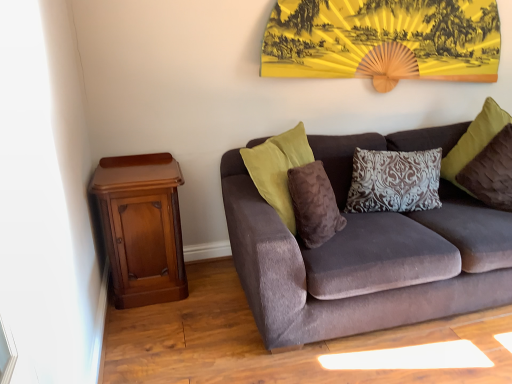
What is the approximate height of mahogany wood nightstand at left?

mahogany wood nightstand at left is 29.92 inches tall.

This screenshot has width=512, height=384. In order to click on yellow paper fan at upper center in this screenshot , I will do `click(383, 40)`.

Describe the element at coordinates (474, 140) in the screenshot. I see `velvet brown pillow at upper right, marked as the 3th pillow in a left-to-right arrangement` at that location.

Where is `mahogany wood nightstand at left`? This screenshot has width=512, height=384. mahogany wood nightstand at left is located at coordinates (142, 227).

Which is closer, [160,179] or [437,186]?

Point [160,179] is positioned closer to the camera compared to point [437,186].

Where is `the 1st pillow directly above the mahogany wood nightstand at left (from a real-world perspective)`? The height and width of the screenshot is (384, 512). the 1st pillow directly above the mahogany wood nightstand at left (from a real-world perspective) is located at coordinates (394, 181).

From a real-world perspective, who is located lower, mahogany wood nightstand at left or brown damask pillow at center, placed as the 2th pillow when sorted from left to right?

mahogany wood nightstand at left.

From the picture: Who is shorter, mahogany wood nightstand at left or brown damask pillow at center, placed as the 2th pillow when sorted from left to right?

With less height is brown damask pillow at center, placed as the 2th pillow when sorted from left to right.

Would you say velvet brown couch at center is part of mahogany wood nightstand at left's contents?

No.

Considering the sizes of mahogany wood nightstand at left and velvet brown couch at center in the image, is mahogany wood nightstand at left bigger or smaller than velvet brown couch at center?

In the image, mahogany wood nightstand at left appears to be smaller than velvet brown couch at center.

This screenshot has width=512, height=384. In order to click on studio couch above the mahogany wood nightstand at left (from the image's perspective) in this screenshot , I will do `click(365, 264)`.

From a real-world perspective, is mahogany wood nightstand at left located higher than velvet brown couch at center?

Incorrect, from a real-world perspective, mahogany wood nightstand at left is lower than velvet brown couch at center.

Considering the positions of objects mahogany wood nightstand at left and velvet brown pillow at upper right, marked as the 1th pillow in a right-to-left arrangement, in the image provided, who is more to the right, mahogany wood nightstand at left or velvet brown pillow at upper right, marked as the 1th pillow in a right-to-left arrangement,?

velvet brown pillow at upper right, marked as the 1th pillow in a right-to-left arrangement, is more to the right.

The width and height of the screenshot is (512, 384). In order to click on nightstand below the velvet brown pillow at upper right, marked as the 1th pillow in a right-to-left arrangement (from a real-world perspective) in this screenshot , I will do `click(142, 227)`.

Considering the positions of points (117, 298) and (447, 177), is point (117, 298) farther from camera compared to point (447, 177)?

No.

What's the angular difference between mahogany wood nightstand at left and velvet brown pillow at upper right, marked as the 1th pillow in a right-to-left arrangement,'s facing directions?

19.3 degrees separate the facing orientations of mahogany wood nightstand at left and velvet brown pillow at upper right, marked as the 1th pillow in a right-to-left arrangement.

Does velvet brown pillow at upper right, marked as the 3th pillow in a left-to-right arrangement, have a lesser height compared to brown damask pillow at center, the 2th pillow viewed from the right?

In fact, velvet brown pillow at upper right, marked as the 3th pillow in a left-to-right arrangement, may be taller than brown damask pillow at center, the 2th pillow viewed from the right.

Does velvet brown pillow at upper right, marked as the 3th pillow in a left-to-right arrangement, touch brown damask pillow at center, the 2th pillow viewed from the right?

They are not placed beside each other.

What's the angular difference between velvet brown pillow at upper right, marked as the 3th pillow in a left-to-right arrangement, and brown damask pillow at center, the 2th pillow viewed from the right,'s facing directions?

There is a 15.7-degree angle between the facing directions of velvet brown pillow at upper right, marked as the 3th pillow in a left-to-right arrangement, and brown damask pillow at center, the 2th pillow viewed from the right.

Which is behind, point (490, 98) or point (425, 180)?

The point (490, 98) is more distant.

Locate an element on the screen. Image resolution: width=512 pixels, height=384 pixels. studio couch in front of the brown damask pillow at center, the 2th pillow viewed from the right is located at coordinates (365, 264).

Is brown damask pillow at center, placed as the 2th pillow when sorted from left to right, thinner than velvet brown couch at center?

Yes.

Which is more to the left, brown damask pillow at center, the 2th pillow viewed from the right, or velvet brown couch at center?

brown damask pillow at center, the 2th pillow viewed from the right, is more to the left.

In the scene shown: From the image's perspective, which is above, brown damask pillow at center, placed as the 2th pillow when sorted from left to right, or velvet brown couch at center?

brown damask pillow at center, placed as the 2th pillow when sorted from left to right, from the image's perspective.

Between velvet brown couch at center and velvet brown pillow at upper right, marked as the 1th pillow in a right-to-left arrangement, which one has larger width?

With larger width is velvet brown couch at center.

Which object is further away from the camera taking this photo, velvet brown couch at center or velvet brown pillow at upper right, marked as the 3th pillow in a left-to-right arrangement?

velvet brown pillow at upper right, marked as the 3th pillow in a left-to-right arrangement, is further from the camera.

Between velvet brown couch at center and velvet brown pillow at upper right, marked as the 1th pillow in a right-to-left arrangement, which one appears on the right side from the viewer's perspective?

Positioned to the right is velvet brown pillow at upper right, marked as the 1th pillow in a right-to-left arrangement.

From the image's perspective, would you say velvet brown couch at center is shown under velvet brown pillow at upper right, marked as the 1th pillow in a right-to-left arrangement?

Indeed, from the image's perspective, velvet brown couch at center is shown beneath velvet brown pillow at upper right, marked as the 1th pillow in a right-to-left arrangement.

Image resolution: width=512 pixels, height=384 pixels. Identify the location of mountain view above the velvet brown pillow at upper right, marked as the 1th pillow in a right-to-left arrangement (from the image's perspective). (383, 40).

Between point (489, 110) and point (338, 39), which one is positioned behind?

The point (489, 110) is more distant.

Can you tell me how much velvet brown pillow at upper right, marked as the 3th pillow in a left-to-right arrangement, and yellow paper fan at upper center differ in facing direction?

The facing directions of velvet brown pillow at upper right, marked as the 3th pillow in a left-to-right arrangement, and yellow paper fan at upper center are 19.7 degrees apart.

From a real-world perspective, who is located higher, velvet brown pillow at upper right, marked as the 1th pillow in a right-to-left arrangement, or yellow paper fan at upper center?

yellow paper fan at upper center.

Find the location of a particular element. nightstand that is in front of the brown damask pillow at center, placed as the 2th pillow when sorted from left to right is located at coordinates (142, 227).

This screenshot has width=512, height=384. What are the coordinates of `studio couch on the right of mahogany wood nightstand at left` in the screenshot? It's located at (365, 264).

Looking at the image, which one is located closer to mahogany wood nightstand at left, brown fuzzy pillow at center, positioned as the first pillow in left-to-right order, or yellow paper fan at upper center?

brown fuzzy pillow at center, positioned as the first pillow in left-to-right order.

Looking at the image, which one is located closer to brown damask pillow at center, the 2th pillow viewed from the right, velvet brown couch at center or velvet brown pillow at upper right, marked as the 1th pillow in a right-to-left arrangement?

Among the two, velvet brown couch at center is located nearer to brown damask pillow at center, the 2th pillow viewed from the right.

From the picture: Which object lies further to the anchor point brown damask pillow at center, placed as the 2th pillow when sorted from left to right, brown fuzzy pillow at center, which ranks as the 3th pillow in right-to-left order, or velvet brown couch at center?

Based on the image, brown fuzzy pillow at center, which ranks as the 3th pillow in right-to-left order, appears to be further to brown damask pillow at center, placed as the 2th pillow when sorted from left to right.

Looking at the image, which one is located closer to velvet brown couch at center, velvet brown pillow at upper right, marked as the 1th pillow in a right-to-left arrangement, or yellow paper fan at upper center?

velvet brown pillow at upper right, marked as the 1th pillow in a right-to-left arrangement, lies closer to velvet brown couch at center than the other object.

Estimate the real-world distances between objects in this image. Which object is closer to velvet brown pillow at upper right, marked as the 1th pillow in a right-to-left arrangement, brown fuzzy pillow at center, positioned as the first pillow in left-to-right order, or brown damask pillow at center, the 2th pillow viewed from the right?

brown damask pillow at center, the 2th pillow viewed from the right.

Which object lies nearer to the anchor point brown fuzzy pillow at center, which ranks as the 3th pillow in right-to-left order, mahogany wood nightstand at left or velvet brown pillow at upper right, marked as the 1th pillow in a right-to-left arrangement?

Based on the image, mahogany wood nightstand at left appears to be nearer to brown fuzzy pillow at center, which ranks as the 3th pillow in right-to-left order.

From the image, which object appears to be farther from velvet brown couch at center, mahogany wood nightstand at left or brown damask pillow at center, the 2th pillow viewed from the right?

The object further to velvet brown couch at center is mahogany wood nightstand at left.

From the image, which object appears to be farther from velvet brown pillow at upper right, marked as the 3th pillow in a left-to-right arrangement, velvet brown couch at center or brown damask pillow at center, placed as the 2th pillow when sorted from left to right?

velvet brown couch at center is further to velvet brown pillow at upper right, marked as the 3th pillow in a left-to-right arrangement.

This screenshot has width=512, height=384. I want to click on mountain view between mahogany wood nightstand at left and brown damask pillow at center, placed as the 2th pillow when sorted from left to right, in the horizontal direction, so click(x=383, y=40).

You are a GUI agent. You are given a task and a screenshot of the screen. Output one action in this format:
    pyautogui.click(x=<x>, y=<y>)
    Task: Click on the pillow situated between mahogany wood nightstand at left and brown damask pillow at center, the 2th pillow viewed from the right, from left to right
    This screenshot has height=384, width=512.
    Given the screenshot: What is the action you would take?
    (314, 204)

This screenshot has height=384, width=512. What are the coordinates of `mountain view located between mahogany wood nightstand at left and velvet brown pillow at upper right, marked as the 3th pillow in a left-to-right arrangement, in the left-right direction` in the screenshot? It's located at (383, 40).

At what (x,y) coordinates should I click in order to perform the action: click on mountain view between brown fuzzy pillow at center, positioned as the first pillow in left-to-right order, and velvet brown pillow at upper right, marked as the 3th pillow in a left-to-right arrangement, in the horizontal direction. Please return your answer as a coordinate pair (x, y). The image size is (512, 384). Looking at the image, I should click on (383, 40).